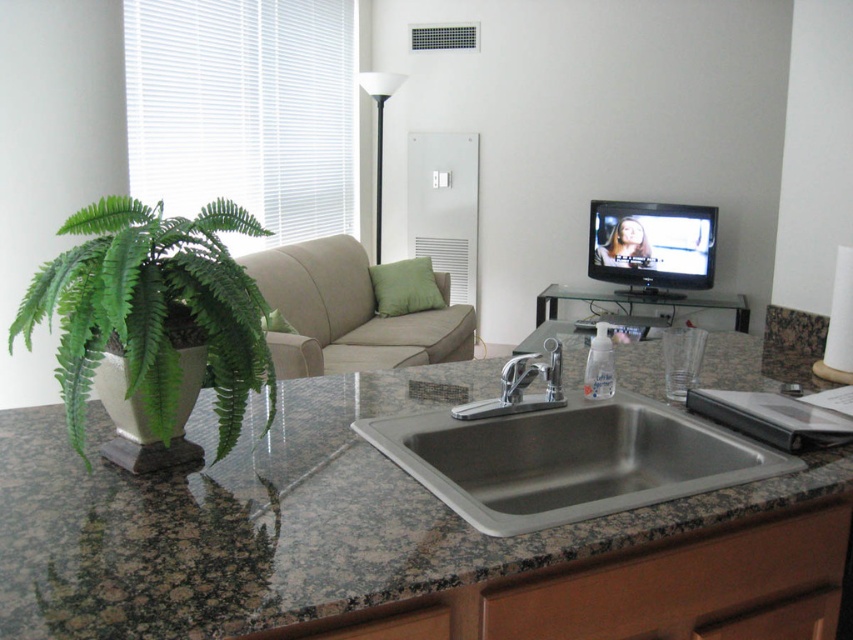
Question: Can you confirm if green leafy fern at left is wider than stainless steel sink at center?

Choices:
 (A) no
 (B) yes

Answer: (A)

Question: Does stainless steel sink at center lie in front of silver metallic faucet at sink center?

Choices:
 (A) no
 (B) yes

Answer: (B)

Question: Which point appears farthest from the camera in this image?

Choices:
 (A) (194, 618)
 (B) (222, 320)

Answer: (B)

Question: Is granite at center below stainless steel sink at center?

Choices:
 (A) yes
 (B) no

Answer: (A)

Question: Estimate the real-world distances between objects in this image. Which object is closer to the silver metallic faucet at sink center?

Choices:
 (A) stainless steel sink at center
 (B) beige fabric couch at center
 (C) white matte floor lamp at center

Answer: (A)

Question: Which point appears farthest from the camera in this image?

Choices:
 (A) (492, 445)
 (B) (321, 246)
 (C) (378, 161)
 (D) (537, 364)

Answer: (C)